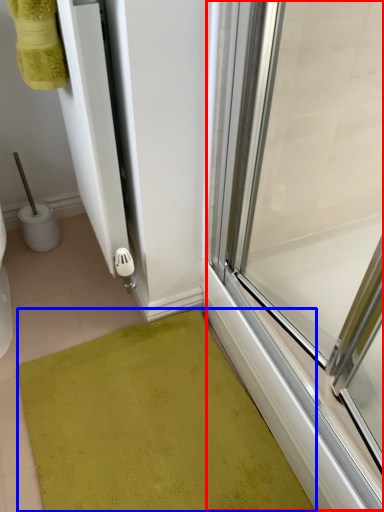
Question: Among these objects, which one is farthest to the camera, glass door (highlighted by a red box) or bath mat (highlighted by a blue box)?

Choices:
 (A) glass door
 (B) bath mat

Answer: (B)